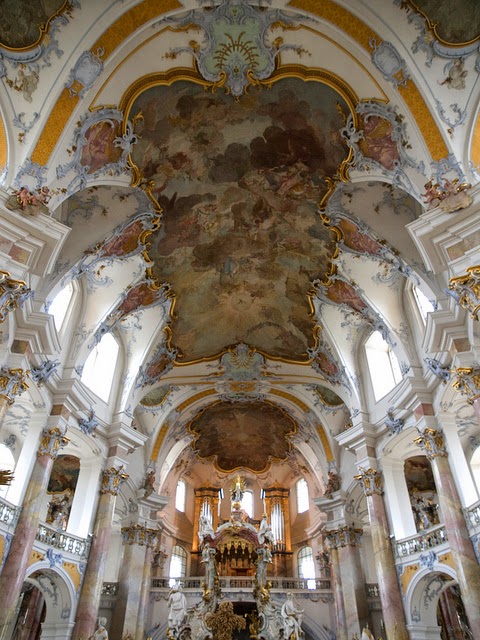
The image size is (480, 640). I want to click on windows, so [x=60, y=312], [x=101, y=371], [x=396, y=358], [x=426, y=305].